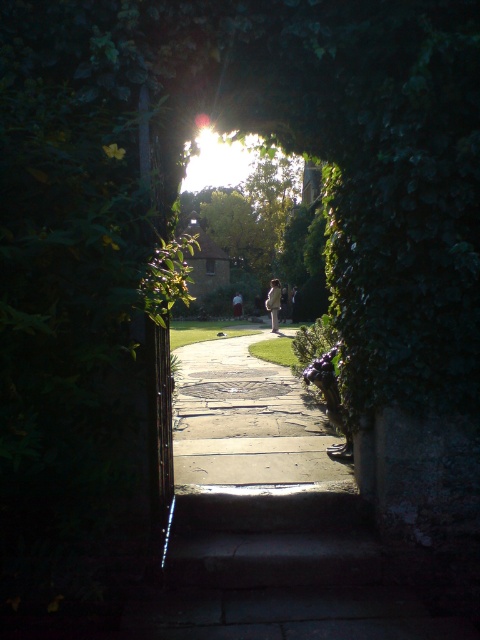
Question: Which point is farther from the camera taking this photo?

Choices:
 (A) (264, 387)
 (B) (272, 291)

Answer: (B)

Question: Is smooth concrete path at center thinner than light beige coat at center?

Choices:
 (A) no
 (B) yes

Answer: (A)

Question: Is smooth concrete path at center thinner than light beige coat at center?

Choices:
 (A) no
 (B) yes

Answer: (A)

Question: Among these points, which one is farthest from the camera?

Choices:
 (A) (265, 300)
 (B) (236, 349)

Answer: (A)

Question: Which object is farther from the camera taking this photo?

Choices:
 (A) smooth concrete path at center
 (B) light beige coat at center

Answer: (B)

Question: Can you confirm if smooth concrete path at center is positioned to the left of light beige coat at center?

Choices:
 (A) yes
 (B) no

Answer: (A)